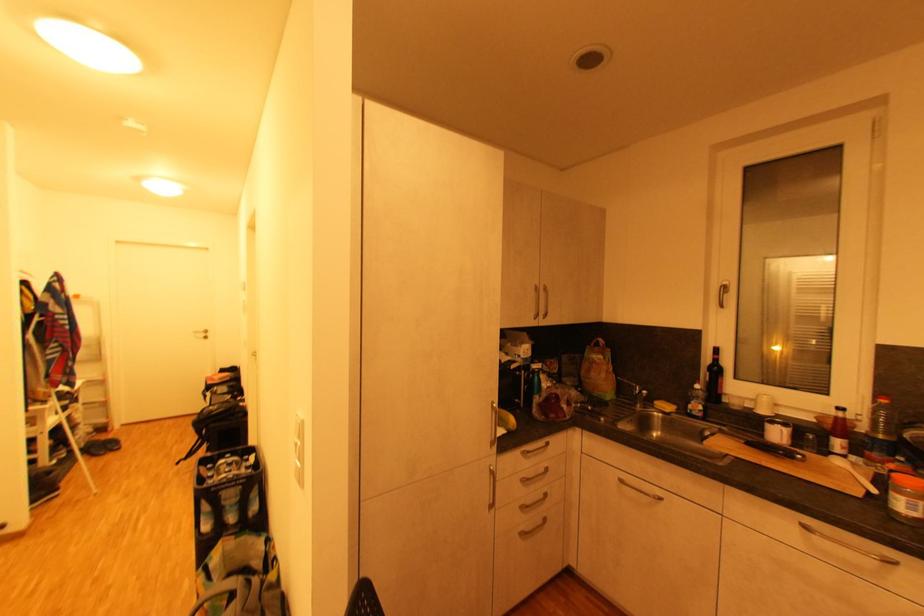
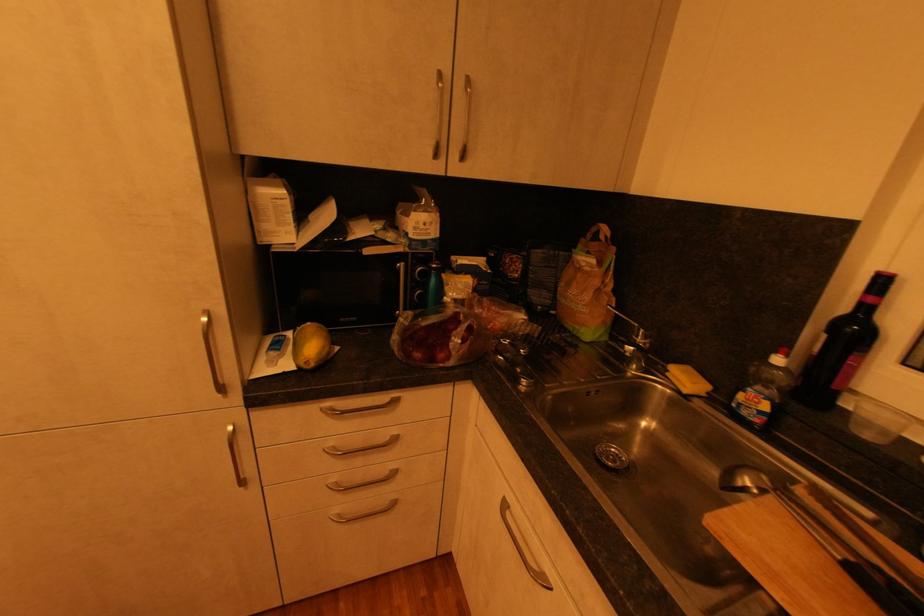
Locate, in the second image, the point that corresponds to (659,406) in the first image.

(672, 371)